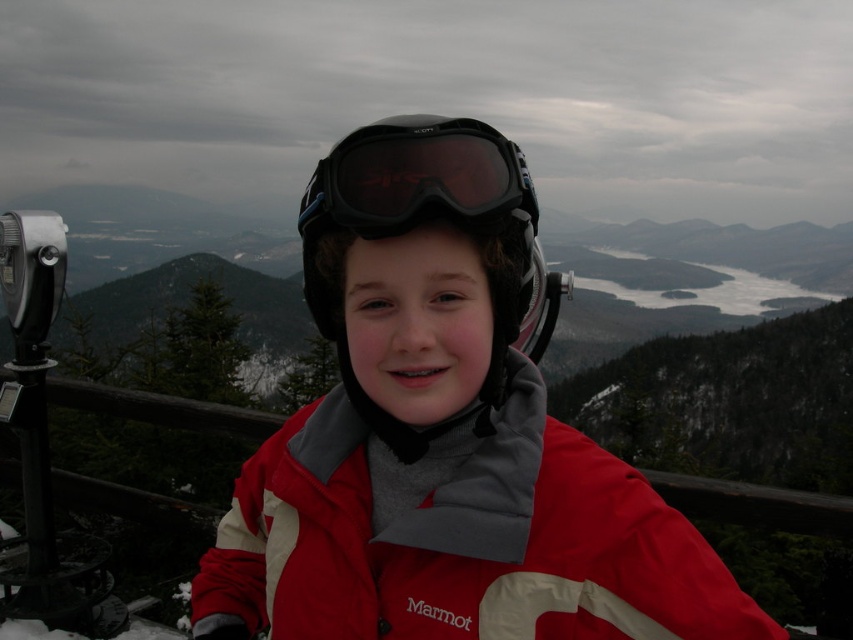
Question: Can you confirm if black matte helmet at center is thinner than black matte ski goggles at center?

Choices:
 (A) yes
 (B) no

Answer: (B)

Question: Where is matte red jacket at center located in relation to black matte ski goggles at center in the image?

Choices:
 (A) right
 (B) left

Answer: (A)

Question: Is black matte helmet at center further to the viewer compared to black matte ski goggles at center?

Choices:
 (A) yes
 (B) no

Answer: (A)

Question: Based on their relative distances, which object is farther from the black matte helmet at center?

Choices:
 (A) matte red jacket at center
 (B) black matte ski goggles at center

Answer: (B)

Question: Which of the following is the closest to the observer?

Choices:
 (A) matte red jacket at center
 (B) black matte ski goggles at center

Answer: (A)

Question: Among these points, which one is nearest to the camera?

Choices:
 (A) (659, 504)
 (B) (525, 310)

Answer: (A)